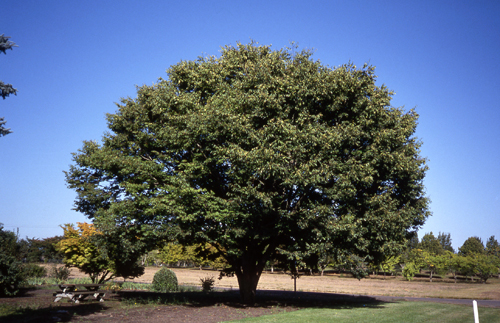
Find the location of a particular element. bench is located at coordinates (76, 290).